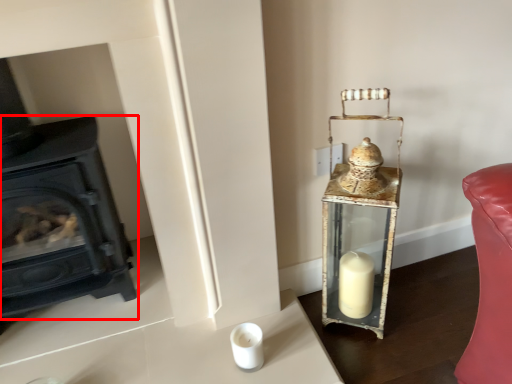
Question: From the image's perspective, what is the correct spatial relationship of wood burning stove (annotated by the red box) in relation to table lamp?

Choices:
 (A) above
 (B) below

Answer: (A)